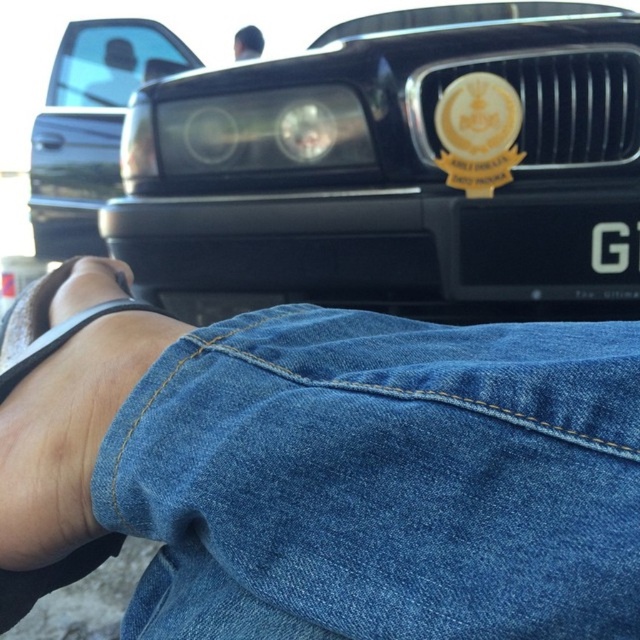
Question: Is denim at lower right positioned in front of black glossy car at center?

Choices:
 (A) yes
 (B) no

Answer: (A)

Question: Can you confirm if black glossy car at center is thinner than black plastic license plate at center?

Choices:
 (A) yes
 (B) no

Answer: (B)

Question: Which point appears closest to the camera in this image?

Choices:
 (A) (499, 259)
 (B) (97, 140)
 (C) (257, 42)

Answer: (A)

Question: Considering the real-world distances, which object is closest to the matte black toe at lower left?

Choices:
 (A) denim at lower right
 (B) black plastic license plate at center
 (C) black glossy bumper at center

Answer: (A)

Question: Is denim at lower right to the left of matte black car at upper left from the viewer's perspective?

Choices:
 (A) no
 (B) yes

Answer: (A)

Question: Which point is closer to the camera?

Choices:
 (A) black glossy bumper at center
 (B) blue denim jeans at lower left
 (C) glossy black car at upper left
 (D) black glossy car at center

Answer: (B)